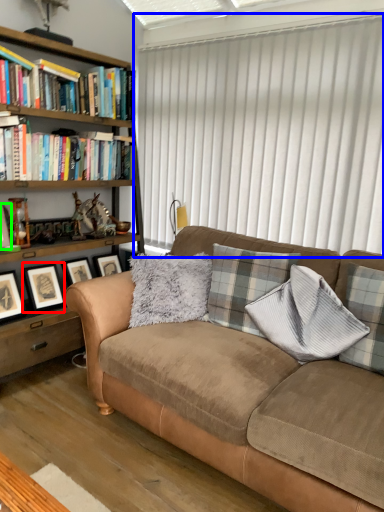
Question: Based on their relative distances, which object is nearer to picture frame (highlighted by a red box)? Choose from window blind (highlighted by a blue box) and picture frame (highlighted by a green box).

Choices:
 (A) window blind
 (B) picture frame

Answer: (B)